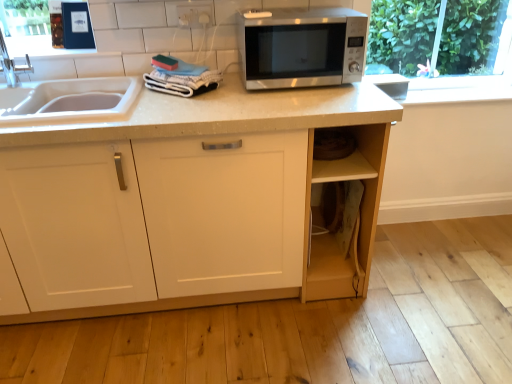
I want to click on empty space that is to the right of matte white cabinet at center, so click(x=406, y=297).